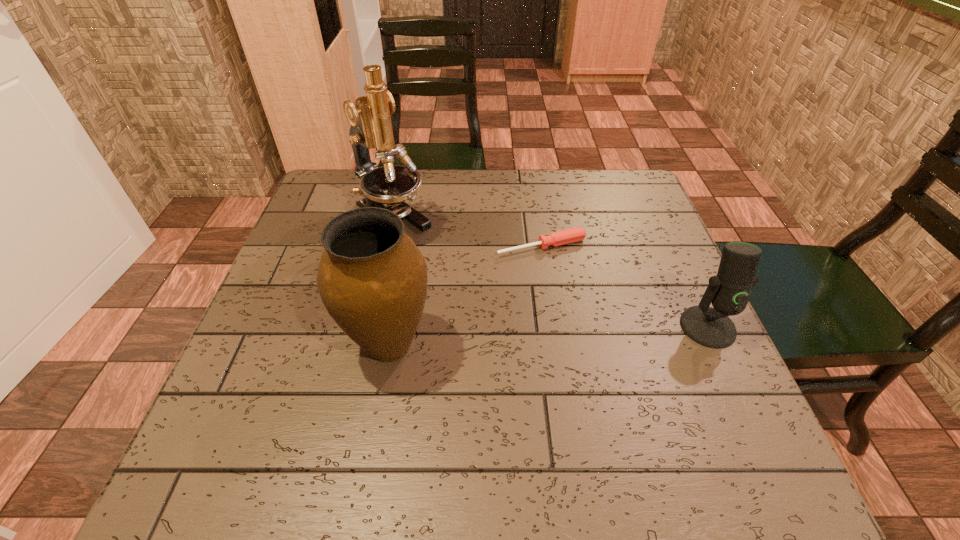
Identify the location of vacant space at the left edge of the desktop. (306, 271).

This screenshot has height=540, width=960. I want to click on free space at the right edge of the desktop, so click(x=634, y=263).

The width and height of the screenshot is (960, 540). Find the location of `free spot at the far left corner of the desktop`. free spot at the far left corner of the desktop is located at coordinates (357, 197).

Locate an element on the screen. This screenshot has height=540, width=960. free space at the near left corner of the desktop is located at coordinates (311, 393).

The width and height of the screenshot is (960, 540). In the image, there is a desktop. In order to click on vacant space at the far right corner in this screenshot , I will do `click(607, 186)`.

Locate an element on the screen. vacant area that lies between the urn and the third tallest object is located at coordinates click(548, 336).

Where is `free space between the urn and the screwdriver`? free space between the urn and the screwdriver is located at coordinates (466, 295).

What are the coordinates of `free spot between the second tallest object and the rightmost object` in the screenshot? It's located at (548, 336).

I want to click on empty space that is in between the second shortest object and the second object from right to left, so click(625, 287).

This screenshot has height=540, width=960. Find the location of `free spot between the third object from left to right and the tallest object`. free spot between the third object from left to right and the tallest object is located at coordinates (467, 235).